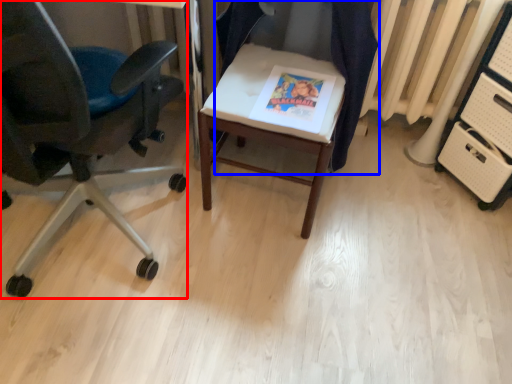
Question: Which of the following is the farthest to the observer, chair (highlighted by a red box) or chair (highlighted by a blue box)?

Choices:
 (A) chair
 (B) chair

Answer: (B)